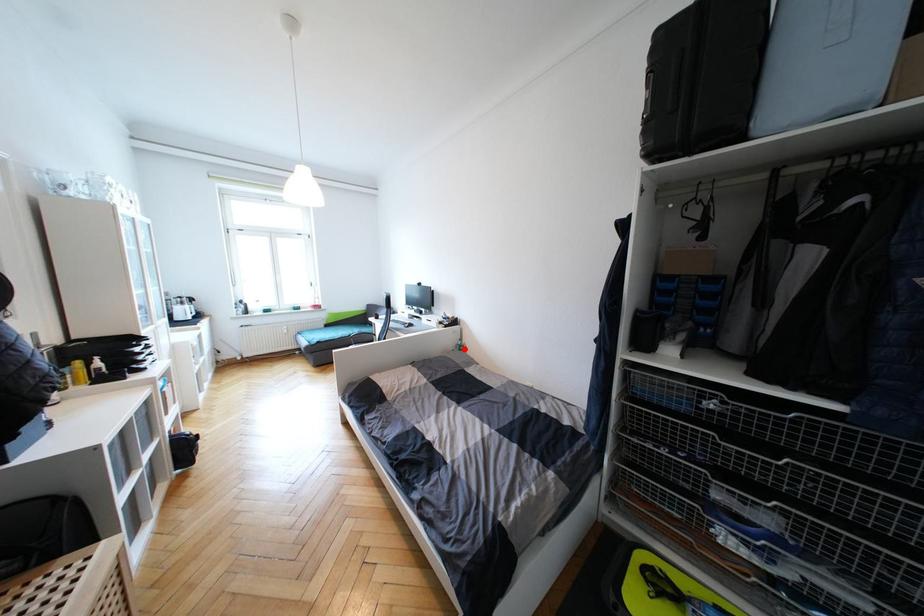
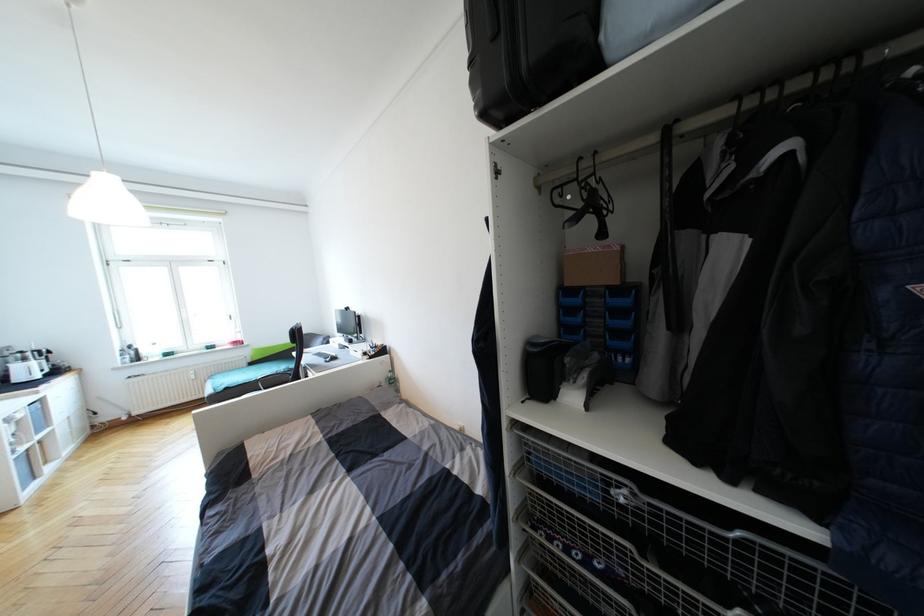
Find the pixel in the second image that matches the highlighted location in the first image.

(395, 382)